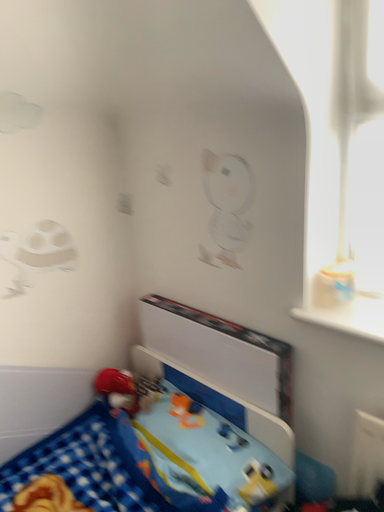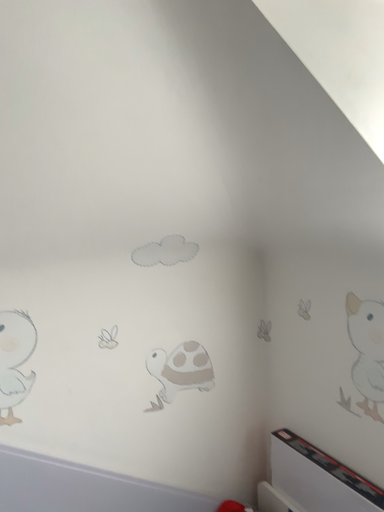
Question: How did the camera likely rotate when shooting the video?

Choices:
 (A) rotated upward
 (B) rotated downward

Answer: (A)